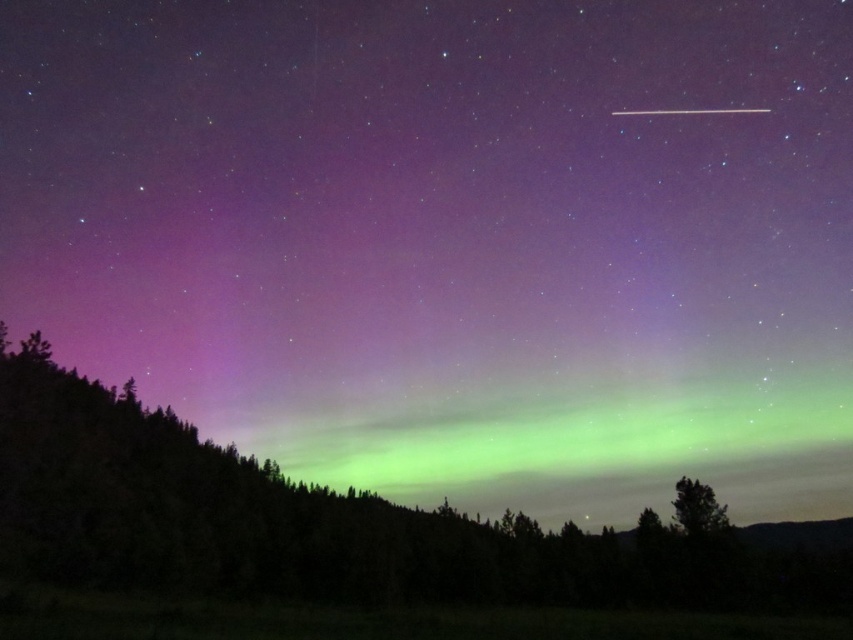
You are an astronaut on a spacewalk and looking down at the Earth. You see the green matte forest at lower center and the green leafy tree at lower right. Which one appears bigger from your perspective?

The green matte forest at lower center appears bigger than the green leafy tree at lower right because it is larger in size.

You are a photographer standing in the middle of the scene. You want to capture both the green matte forest at lower center and the green leafy tree at lower right in a single wide shot. Which object should you frame first to ensure both are fully visible in your photo?

You should frame the green matte forest at lower center first because it is wider than the green leafy tree at lower right, so positioning it first ensures there is enough space for both in the frame.

You are a hiker who has just set up camp under the Northern Lights. Your tent is located at the green leafy tree at lower right. You need to retrieve your flashlight that fell into the green matte forest at lower center. Considering the distance between them, can you safely walk from your tent to the forest to retrieve it without needing a guide?

The distance between the green matte forest at lower center and the green leafy tree at lower right is 168.95 feet. Since this distance is manageable for a hiker to walk in a straight line without needing a guide, you can safely retrieve your flashlight.